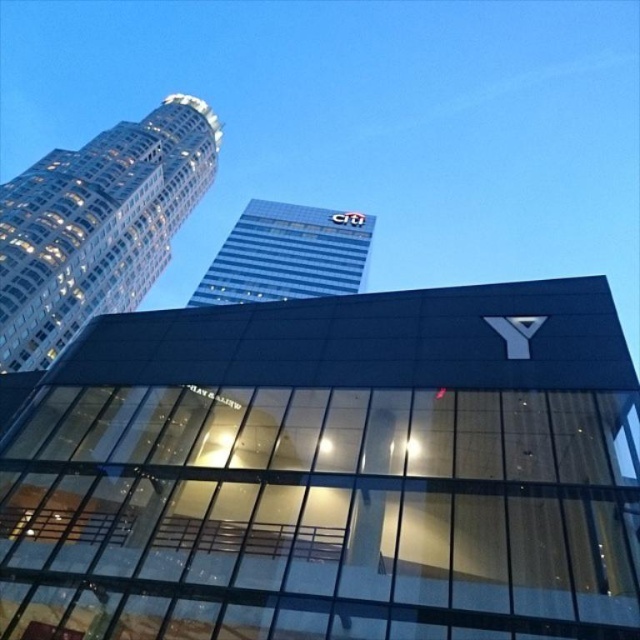
You are a city planner assessing the skyline. You need to determine if the distance between the white glass skyscraper at upper left and the blue glass building at upper center is sufficient for a new drone delivery route that requires a minimum of 20 meters clearance. Can the route be established between them?

The white glass skyscraper at upper left and blue glass building at upper center are 23.71 meters apart, which exceeds the required 20 meters clearance. Therefore, the drone delivery route can be safely established between them.

Consider the image. You are standing at the base of the contemporary building in the scene. You want to take a photo of the white glass skyscraper at upper left. Considering the distance, should you use a zoom lens or a wide angle lens?

The white glass skyscraper at upper left is 59.39 meters away from the viewer. Since it is relatively far away, you should use a zoom lens to capture it clearly.

You are a city planner reviewing this urban layout. You need to determine the spatial relationship between the white glass skyscraper at upper left and the blue glass building at upper center. Which one is closer to the observer?

The white glass skyscraper at upper left is closer to the observer because it is in front of the blue glass building at upper center.